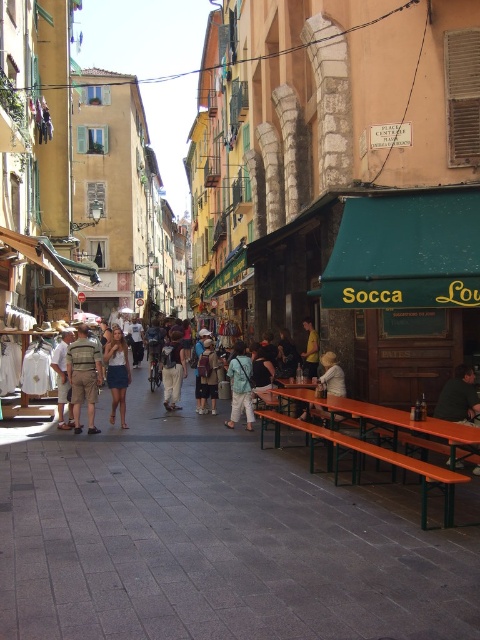
You are standing at point [66,374] and want to walk to point [124,408]. Given that the street is narrow and lined with buildings on both sides, will you have to walk against the flow of traffic or with it?

The point [124,408] is behind point [66,374], so you will have to walk against the flow of traffic to reach it.